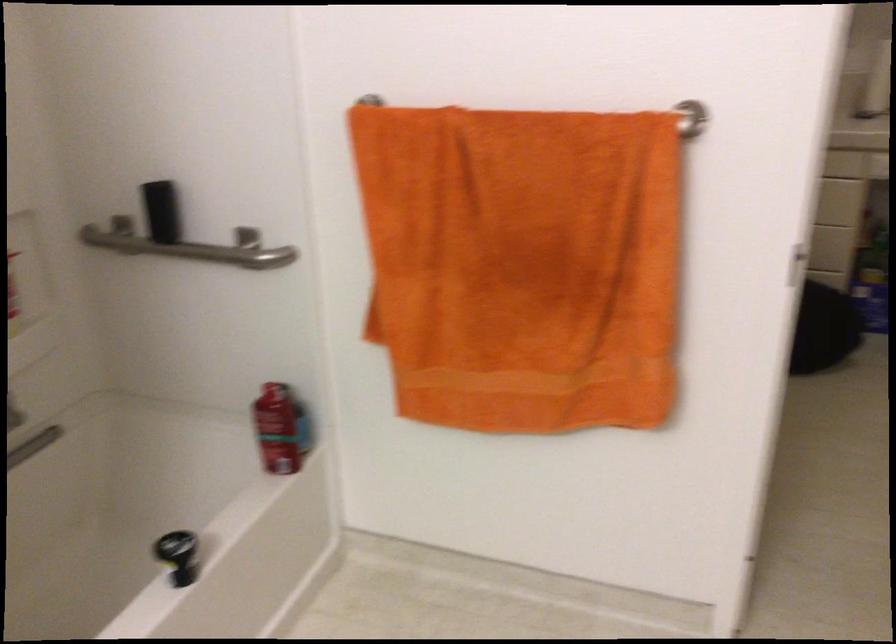
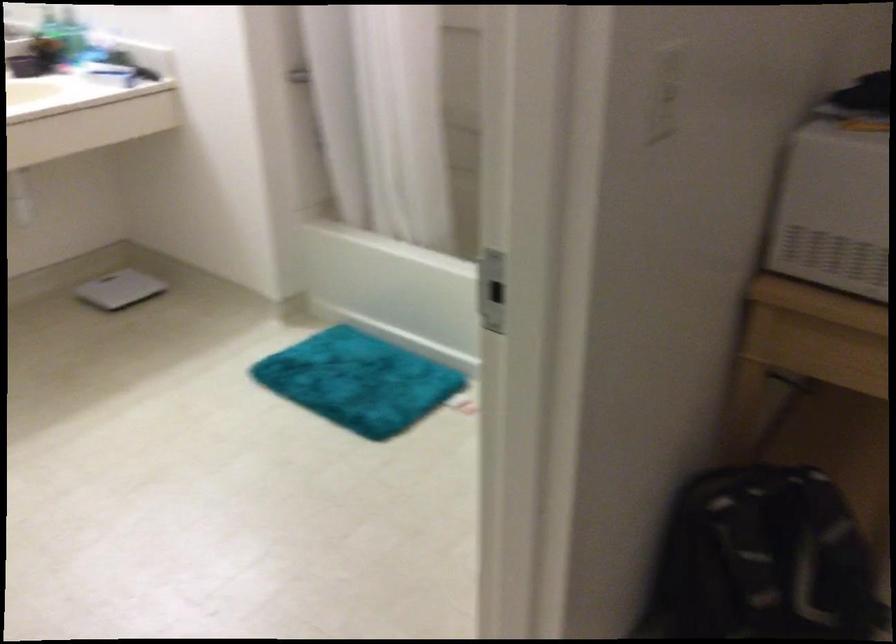
Where in the second image is the point corresponding to point 693,118 from the first image?

(666, 93)